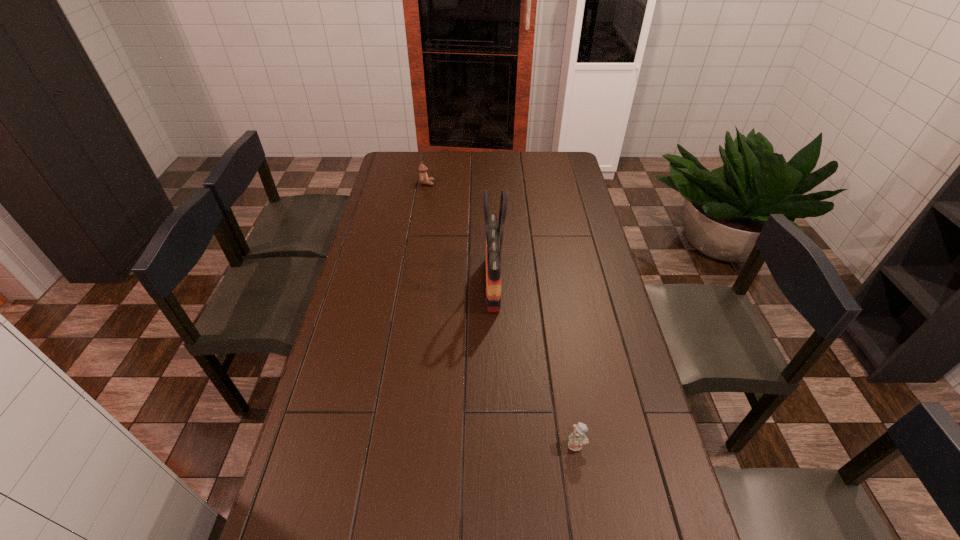
Identify the location of vacant point located 0.150m on the front-facing side of the nearest object. (588, 516).

Find the location of a particular element. vacant space at the far edge is located at coordinates (452, 173).

Find the location of `vacant area at the left edge of the desktop`. vacant area at the left edge of the desktop is located at coordinates (354, 311).

Where is `vacant region at the right edge of the desktop`? vacant region at the right edge of the desktop is located at coordinates (550, 206).

Where is `free space between the rightmost object and the farther teddy bear`? This screenshot has width=960, height=540. free space between the rightmost object and the farther teddy bear is located at coordinates (501, 314).

Identify the location of free space between the left teddy bear and the nearer teddy bear. (501, 314).

The height and width of the screenshot is (540, 960). In order to click on vacant region between the shopping bag and the leftmost object in this screenshot , I will do `click(460, 233)`.

Where is `vacant area between the farther teddy bear and the shortest object`? The width and height of the screenshot is (960, 540). vacant area between the farther teddy bear and the shortest object is located at coordinates (501, 314).

What are the coordinates of `vacant space that is in between the second object from left to right and the shorter teddy bear` in the screenshot? It's located at (535, 364).

What are the coordinates of `free space between the shortest object and the tallest object` in the screenshot? It's located at (535, 364).